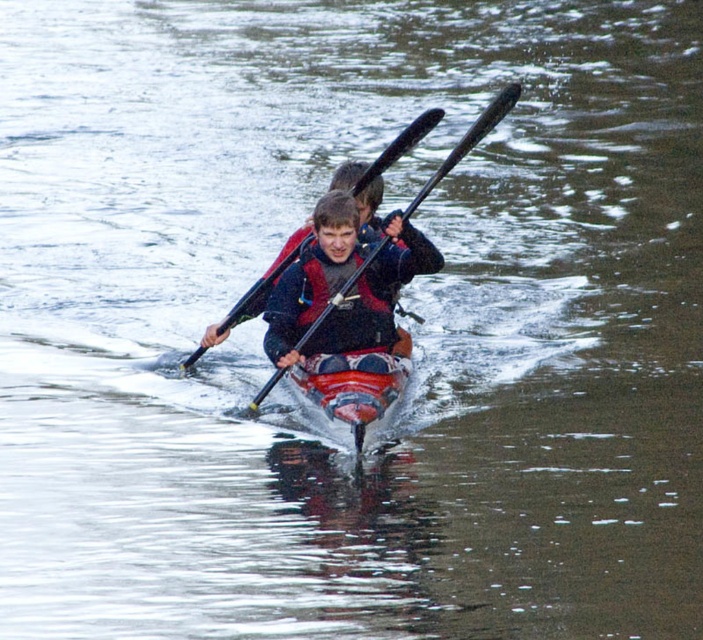
Question: Which object is farther from the camera taking this photo?

Choices:
 (A) black plastic paddle at center
 (B) red plastic canoe at center
 (C) matte red life jacket at center

Answer: (C)

Question: Can you confirm if red plastic canoe at center is positioned above black plastic paddle at center?

Choices:
 (A) yes
 (B) no

Answer: (B)

Question: Based on their relative distances, which object is nearer to the black plastic paddle at center?

Choices:
 (A) matte red life jacket at center
 (B) red plastic canoe at center

Answer: (A)

Question: Which of the following is the farthest from the observer?

Choices:
 (A) (394, 141)
 (B) (342, 342)

Answer: (A)

Question: Can you confirm if matte red life jacket at center is positioned below red plastic canoe at center?

Choices:
 (A) yes
 (B) no

Answer: (B)

Question: Is matte red life jacket at center further to the viewer compared to black plastic paddle at center?

Choices:
 (A) no
 (B) yes

Answer: (B)